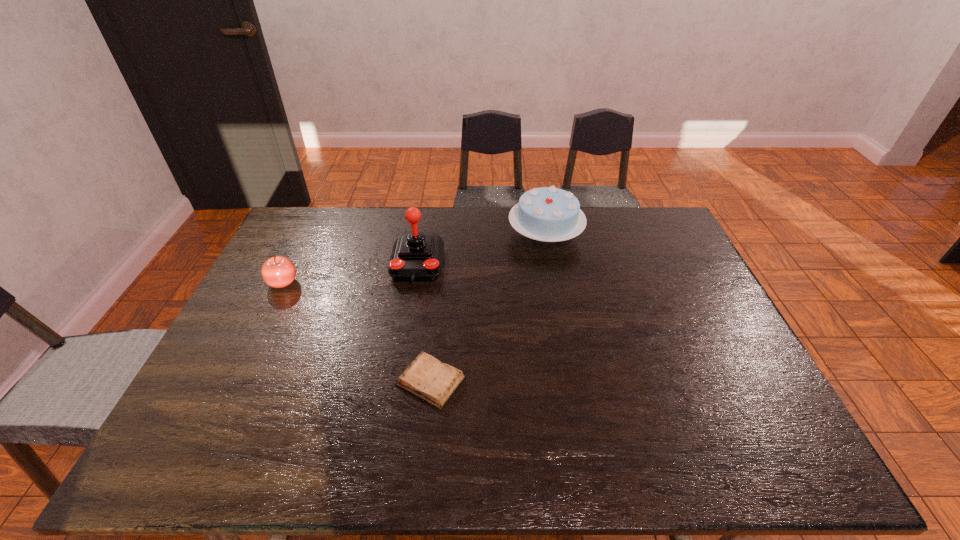
I want to click on vacant area located 0.290m on the right of the shortest object, so click(580, 381).

Locate an element on the screen. joystick that is at the far edge is located at coordinates click(x=417, y=256).

The width and height of the screenshot is (960, 540). In order to click on birthday cake that is positioned at the far edge in this screenshot , I will do `click(549, 214)`.

Where is `object present at the left edge`? object present at the left edge is located at coordinates (278, 271).

The image size is (960, 540). I want to click on free spot at the far edge of the desktop, so click(554, 242).

Locate an element on the screen. This screenshot has height=540, width=960. free region at the near edge is located at coordinates (283, 444).

Locate an element on the screen. vacant region at the left edge of the desktop is located at coordinates pos(244,315).

Identify the location of blank area at the right edge. (692, 268).

Locate an element on the screen. This screenshot has height=540, width=960. vacant point at the far left corner is located at coordinates (324, 232).

I want to click on vacant space at the near left corner of the desktop, so click(x=216, y=449).